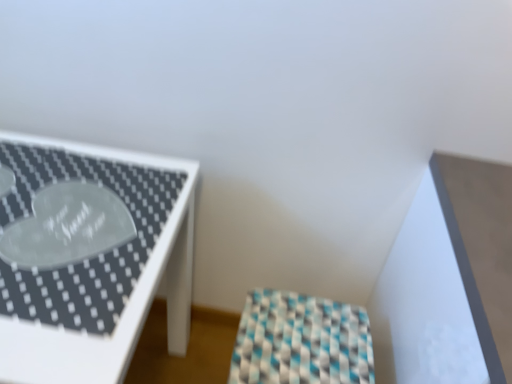
Question: Considering the positions of checkered fabric stool at center, which appears as the second furniture when viewed from the left, and white glossy table at left, positioned as the 1th furniture in left-to-right order, in the image, is checkered fabric stool at center, which appears as the second furniture when viewed from the left, wider or thinner than white glossy table at left, positioned as the 1th furniture in left-to-right order,?

Choices:
 (A) thin
 (B) wide

Answer: (A)

Question: Considering the relative positions of checkered fabric stool at center, which is the 1th furniture in right-to-left order, and white glossy table at left, which appears as the 2th furniture when viewed from the right, in the image provided, is checkered fabric stool at center, which is the 1th furniture in right-to-left order, to the left or to the right of white glossy table at left, which appears as the 2th furniture when viewed from the right,?

Choices:
 (A) right
 (B) left

Answer: (A)

Question: Looking at the image, does checkered fabric stool at center, which appears as the second furniture when viewed from the left, seem bigger or smaller compared to white glossy table at left, positioned as the 1th furniture in left-to-right order?

Choices:
 (A) small
 (B) big

Answer: (A)

Question: In terms of width, does white glossy table at left, positioned as the 1th furniture in left-to-right order, look wider or thinner when compared to checkered fabric stool at center, which is the 1th furniture in right-to-left order?

Choices:
 (A) thin
 (B) wide

Answer: (B)

Question: Is white glossy table at left, which appears as the 2th furniture when viewed from the right, bigger or smaller than checkered fabric stool at center, which appears as the second furniture when viewed from the left?

Choices:
 (A) big
 (B) small

Answer: (A)

Question: Considering their positions, is white glossy table at left, which appears as the 2th furniture when viewed from the right, located in front of or behind checkered fabric stool at center, which is the 1th furniture in right-to-left order?

Choices:
 (A) behind
 (B) front

Answer: (B)

Question: From the image's perspective, is white glossy table at left, positioned as the 1th furniture in left-to-right order, located above or below checkered fabric stool at center, which is the 1th furniture in right-to-left order?

Choices:
 (A) below
 (B) above

Answer: (B)